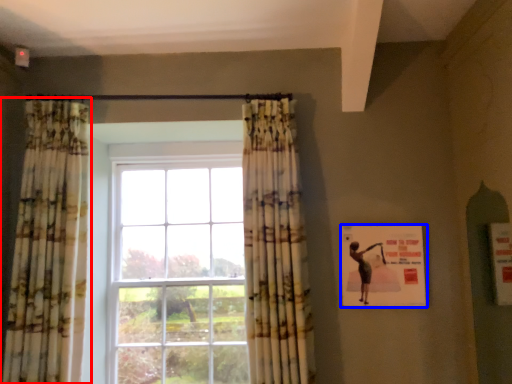
Question: Which point is closer to the camera, curtain (highlighted by a red box) or poster (highlighted by a blue box)?

Choices:
 (A) curtain
 (B) poster

Answer: (A)